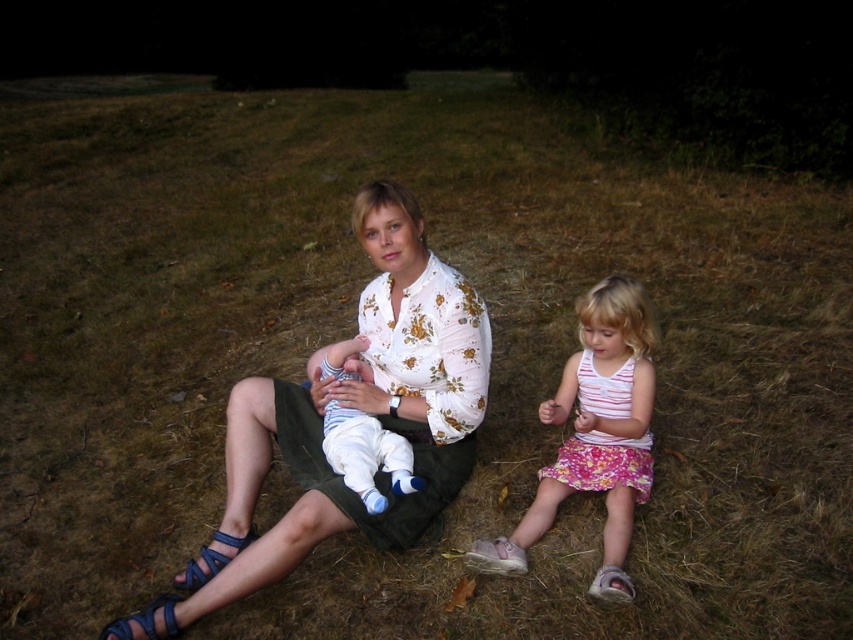
You are organizing a clothing display and need to arrange the floral cotton blouse at center and the pink floral dress at lower right side by side. Based on their widths, which one should be placed on the left to avoid overcrowding the display?

The floral cotton blouse at center might be wider than the pink floral dress at lower right, so placing the blouse on the left would help prevent overcrowding as it requires more space.

You are a photographer trying to capture a closeup shot of the floral cotton blouse at center and the white cotton baby at center. Which object should you focus on first if you want to ensure both are in focus without moving the camera?

The floral cotton blouse at center should be focused on first because it is positioned on the left side of the white cotton baby at center, so focusing on the closer object first would help maintain focus on both.

You are a photographer trying to capture a closeup of the floral cotton blouse at center and the white cotton baby at center. Which one will appear larger in the photo?

The floral cotton blouse at center will appear larger in the photo because it is closer to the viewer than the white cotton baby at center.